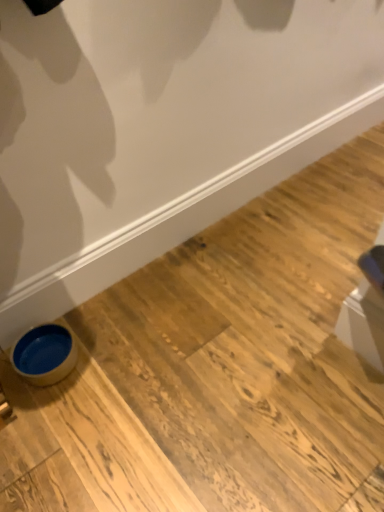
At what (x,y) coordinates should I click in order to perform the action: click on matte blue bowl at lower left. Please return your answer as a coordinate pair (x, y). Image resolution: width=384 pixels, height=512 pixels. Looking at the image, I should click on (45, 354).

Based on the photo, what is the approximate height of matte blue bowl at lower left?

matte blue bowl at lower left is 3.23 inches in height.

The width and height of the screenshot is (384, 512). What do you see at coordinates (45, 354) in the screenshot? I see `matte blue bowl at lower left` at bounding box center [45, 354].

Measure the distance between point (36,373) and camera.

They are 4.52 feet apart.

Locate an element on the screen. matte blue bowl at lower left is located at coordinates (45, 354).